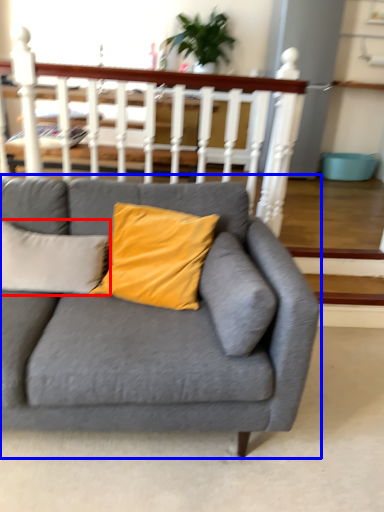
Question: Which of the following is the farthest to the observer, pillow (highlighted by a red box) or studio couch (highlighted by a blue box)?

Choices:
 (A) pillow
 (B) studio couch

Answer: (A)